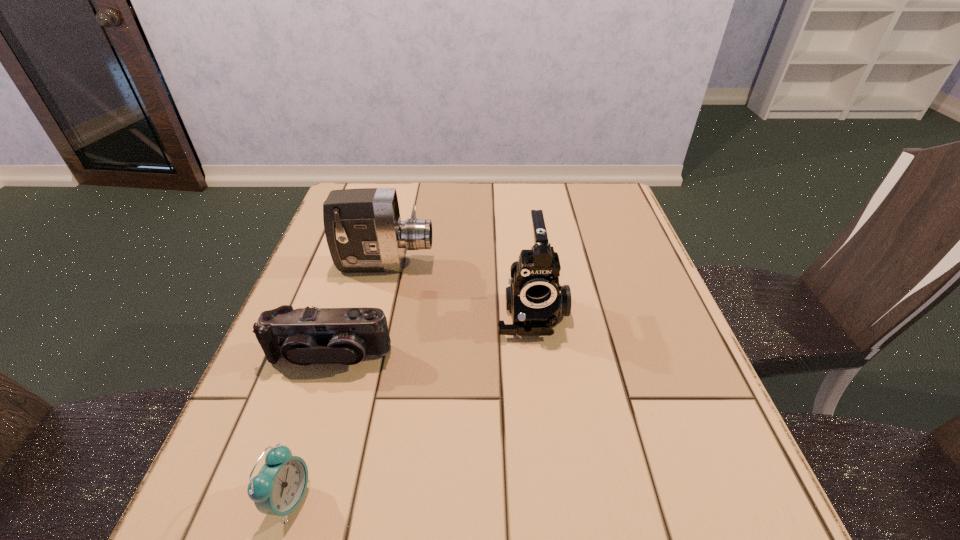
The height and width of the screenshot is (540, 960). I want to click on vacant space that satisfies the following two spatial constraints: 1. at the front of the farthest object, highlighting the lens; 2. on the front-facing side of the shortest camcorder, so click(362, 355).

The width and height of the screenshot is (960, 540). Identify the location of free space that satisfies the following two spatial constraints: 1. at the front of the farthest camcorder, highlighting the lens; 2. on the front-facing side of the shortest camcorder. (362, 355).

I want to click on vacant area in the image that satisfies the following two spatial constraints: 1. on the lens mount of the rightmost object; 2. on the face of the alarm clock, so click(554, 498).

Image resolution: width=960 pixels, height=540 pixels. What are the coordinates of `vacant position in the image that satisfies the following two spatial constraints: 1. at the front of the farthest camcorder, highlighting the lens; 2. on the front-facing side of the shortest camcorder` in the screenshot? It's located at (362, 355).